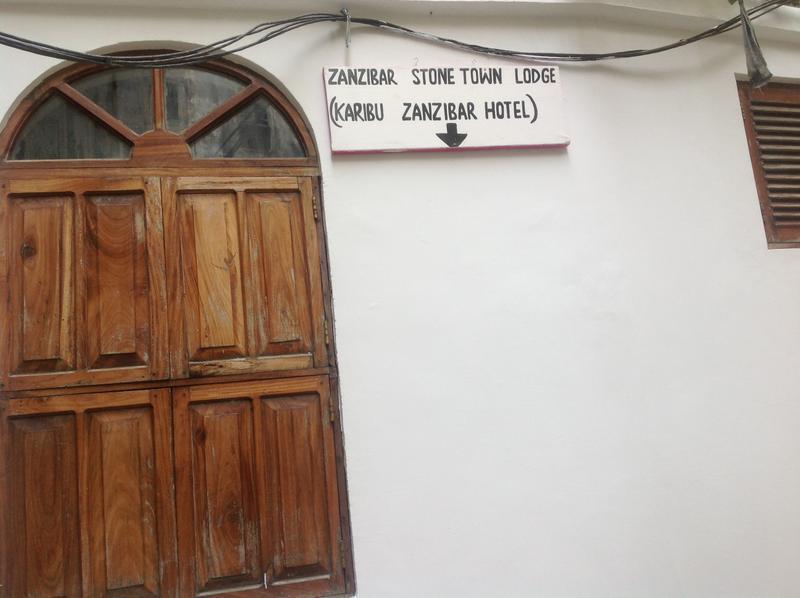
I want to click on wood panels in wood door, so click(54, 243), click(94, 314), click(198, 298), click(282, 286), click(288, 460), click(236, 454), click(126, 466), click(41, 478).